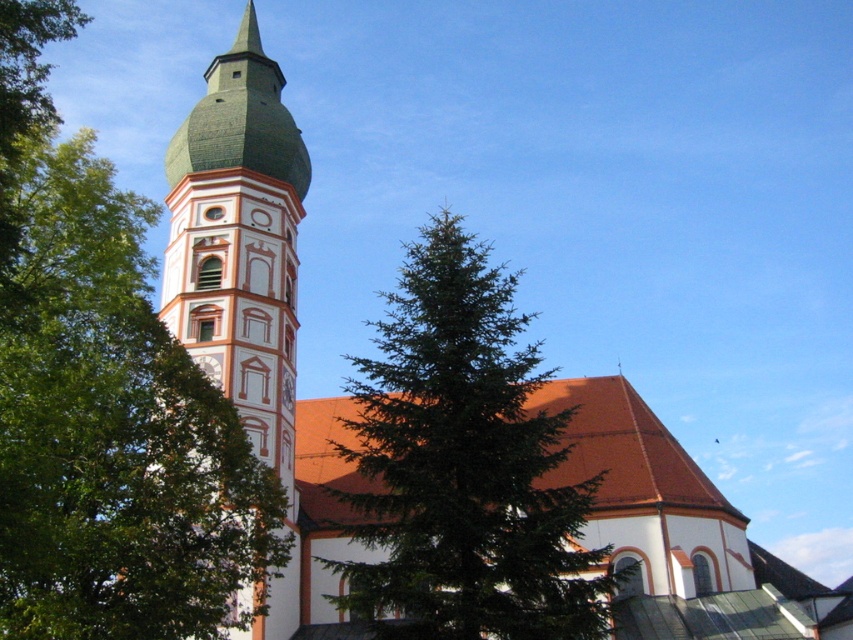
Question: Which of the following is the closest to the observer?

Choices:
 (A) green textured pine tree at center
 (B) green matte steeple at upper left
 (C) green textured pine tree at left

Answer: (C)

Question: Is green textured pine tree at center to the right of green matte steeple at upper left from the viewer's perspective?

Choices:
 (A) yes
 (B) no

Answer: (A)

Question: Is green textured pine tree at left further to camera compared to green textured pine tree at center?

Choices:
 (A) no
 (B) yes

Answer: (A)

Question: Based on their relative distances, which object is farther from the green matte steeple at upper left?

Choices:
 (A) green textured pine tree at center
 (B) green textured pine tree at left

Answer: (A)

Question: Can you confirm if green textured pine tree at center is wider than green matte steeple at upper left?

Choices:
 (A) no
 (B) yes

Answer: (B)

Question: Which of the following is the closest to the observer?

Choices:
 (A) green matte steeple at upper left
 (B) green textured pine tree at center

Answer: (B)